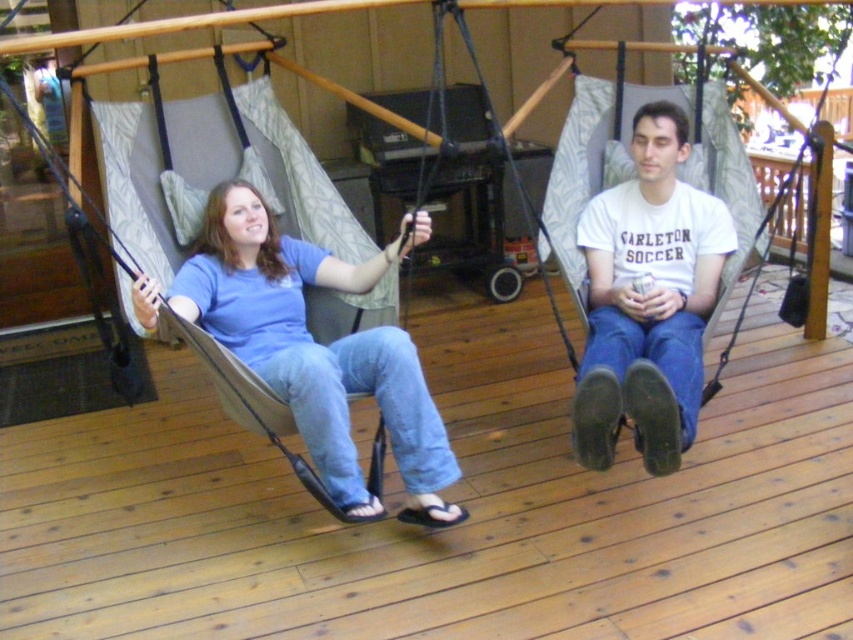
You are a delivery person trying to place a package on the wooden deck at center. The package is 32 inches long. Can you fit it on the deck without overlapping the blue cotton shirt at center?

The wooden deck at center is only 31.86 inches from the blue cotton shirt at center. Since the package is 32 inches long, it will overlap the blue cotton shirt at center if placed there.

You are designing a layout for a new outdoor furniture catalog and need to ensure proper spacing between items. You have the blue cotton shirt at center and the matte gray hammock at left. Which object is shorter in height?

The blue cotton shirt at center has a lesser height compared to matte gray hammock at left, so the blue cotton shirt at center is shorter in height.